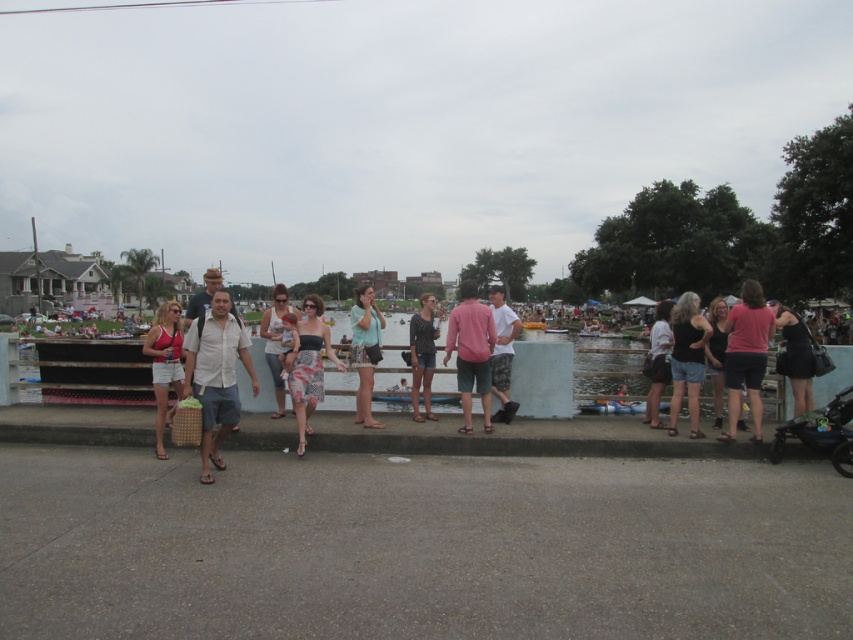
You are standing at the center of the paved area and see the pink cotton shirt at center. If you walk straight ahead, will you reach the water or the concrete barrier first?

The pink cotton shirt at center is located at point (x=471, y=352), which is closer to the water than the concrete barrier. Therefore, walking straight ahead, you would reach the concrete barrier first before the water.

You are a photographer trying to capture a candid shot of the matte black tank top at right and the light blue denim shorts at center. Since you want to ensure both are in focus, you need to know their relative sizes in the frame. Which of the two objects is smaller?

The matte black tank top at right has a smaller size compared to the light blue denim shorts at center, so the matte black tank top at right is the smaller one.